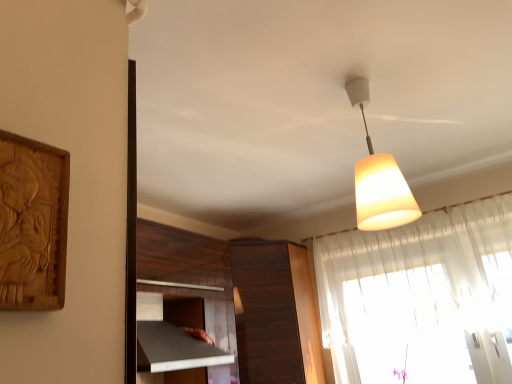
Question: From a real-world perspective, is white matte lampshade at upper center physically located above or below dark wood cabinet at center?

Choices:
 (A) below
 (B) above

Answer: (B)

Question: Relative to dark wood cabinet at center, is white matte lampshade at upper center in front or behind?

Choices:
 (A) front
 (B) behind

Answer: (A)

Question: Estimate the real-world distances between objects in this image. Which object is farther from the dark wood cabinet at center?

Choices:
 (A) white matte lampshade at upper center
 (B) translucent fabric curtain at upper right

Answer: (A)

Question: Which object is positioned closest to the translucent fabric curtain at upper right?

Choices:
 (A) white matte lampshade at upper center
 (B) dark wood cabinet at center

Answer: (B)